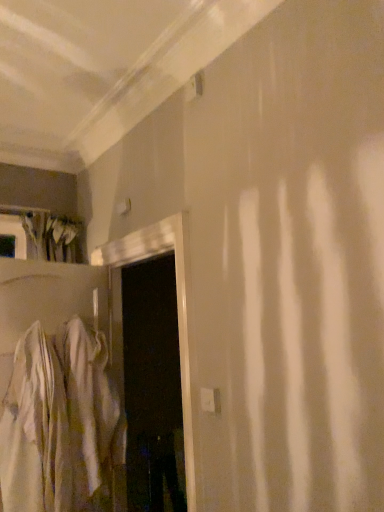
In order to face white glossy door at center, should I rotate leftwards or rightwards?

Turn left approximately 7.551 degrees to face it.

What do you see at coordinates (177, 308) in the screenshot?
I see `white glossy door at center` at bounding box center [177, 308].

Find the location of a particular element. white glossy door at center is located at coordinates (177, 308).

This screenshot has height=512, width=384. Describe the element at coordinates (59, 422) in the screenshot. I see `white cotton robe at left` at that location.

What is the approximate width of white cotton robe at left?

It is 5.27 inches.

Find the location of a particular element. white cotton robe at left is located at coordinates (59, 422).

Measure the distance between white cotton robe at left and camera.

A distance of 1.74 meters exists between white cotton robe at left and camera.

Find the location of `white glossy door at center`. white glossy door at center is located at coordinates (177, 308).

Is white cotton robe at left to the left of white glossy door at center from the viewer's perspective?

Correct, you'll find white cotton robe at left to the left of white glossy door at center.

Considering their positions, is white cotton robe at left located in front of or behind white glossy door at center?

Clearly, white cotton robe at left is behind white glossy door at center.

Is point (53, 400) positioned after point (130, 251)?

No.

From the image's perspective, is white cotton robe at left below white glossy door at center?

Yes.

From a real-world perspective, is white cotton robe at left on top of white glossy door at center?

Actually, white cotton robe at left is physically below white glossy door at center in the real world.

Considering the relative sizes of white cotton robe at left and white glossy door at center in the image provided, is white cotton robe at left thinner than white glossy door at center?

Indeed, white cotton robe at left has a lesser width compared to white glossy door at center.

Considering the sizes of objects white cotton robe at left and white glossy door at center in the image provided, who is taller, white cotton robe at left or white glossy door at center?

With more height is white glossy door at center.

Does white cotton robe at left have a larger size compared to white glossy door at center?

No.

Would you say white glossy door at center is part of white cotton robe at left's contents?

No, white glossy door at center is not inside white cotton robe at left.

Based on the photo, is white cotton robe at left beside white glossy door at center?

There is a gap between white cotton robe at left and white glossy door at center.

Is white cotton robe at left oriented towards white glossy door at center?

Yes, white cotton robe at left is facing white glossy door at center.

Locate an element on the screen. This screenshot has height=512, width=384. robe located underneath the white glossy door at center (from a real-world perspective) is located at coordinates (59, 422).

Would you say white glossy door at center is to the left or to the right of white cotton robe at left in the picture?

white glossy door at center is to the right of white cotton robe at left.

Does white glossy door at center lie behind white cotton robe at left?

No, white glossy door at center is closer to the camera.

Does point (183, 289) appear closer or farther from the camera than point (23, 485)?

Clearly, point (183, 289) is more distant from the camera than point (23, 485).

From the image's perspective, is white glossy door at center positioned above or below white cotton robe at left?

white glossy door at center is situated higher than white cotton robe at left in the image.

From a real-world perspective, is white glossy door at center positioned under white cotton robe at left based on gravity?

No, from a real-world perspective, white glossy door at center is not beneath white cotton robe at left.

Consider the image. Considering the sizes of white glossy door at center and white cotton robe at left in the image, is white glossy door at center wider or thinner than white cotton robe at left?

In the image, white glossy door at center appears to be wider than white cotton robe at left.

Between white glossy door at center and white cotton robe at left, which one has less height?

Standing shorter between the two is white cotton robe at left.

Between white glossy door at center and white cotton robe at left, which one has smaller size?

white cotton robe at left.

Is white glossy door at center not inside white cotton robe at left?

That's correct, white glossy door at center is outside of white cotton robe at left.

Is white glossy door at center far away from white cotton robe at left?

white glossy door at center is actually quite close to white cotton robe at left.

Is white glossy door at center positioned with its back to white cotton robe at left?

That's right, white glossy door at center is facing away from white cotton robe at left.

What's the angular difference between white glossy door at center and white cotton robe at left's facing directions?

The facing directions of white glossy door at center and white cotton robe at left are 109 degrees apart.

I want to click on door in front of the white cotton robe at left, so click(177, 308).

You are a GUI agent. You are given a task and a screenshot of the screen. Output one action in this format:
    pyautogui.click(x=<x>, y=<y>)
    Task: Click on the door above the white cotton robe at left (from the image's perspective)
    The height and width of the screenshot is (512, 384).
    Given the screenshot: What is the action you would take?
    pyautogui.click(x=177, y=308)

I want to click on door above the white cotton robe at left (from a real-world perspective), so click(x=177, y=308).